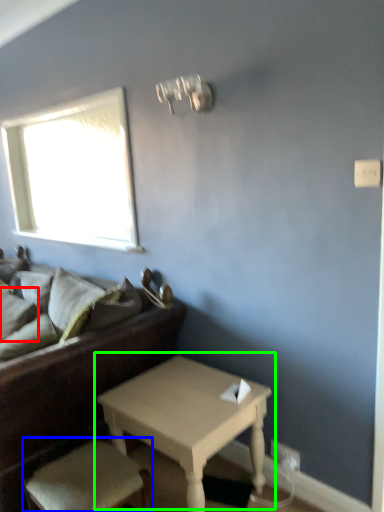
Question: Estimate the real-world distances between objects in this image. Which object is closer to pillow (highlighted by a red box), armchair (highlighted by a blue box) or table (highlighted by a green box)?

Choices:
 (A) armchair
 (B) table

Answer: (A)